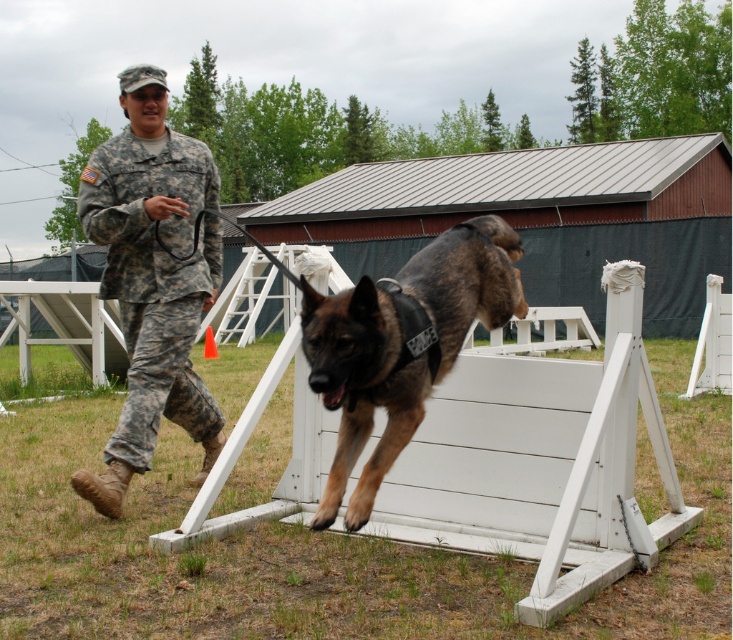
Can you confirm if camouflage uniform at left is positioned to the left of brindle fur dog at center?

Correct, you'll find camouflage uniform at left to the left of brindle fur dog at center.

Image resolution: width=733 pixels, height=640 pixels. What do you see at coordinates (152, 280) in the screenshot?
I see `camouflage uniform at left` at bounding box center [152, 280].

The width and height of the screenshot is (733, 640). Find the location of `camouflage uniform at left`. camouflage uniform at left is located at coordinates (152, 280).

Is white wood hurdle at center bigger than camouflage uniform at left?

Yes, white wood hurdle at center is bigger than camouflage uniform at left.

Which is in front, point (567, 604) or point (108, 448)?

Positioned in front is point (567, 604).

You are a GUI agent. You are given a task and a screenshot of the screen. Output one action in this format:
    pyautogui.click(x=<x>, y=<y>)
    Task: Click on the white wood hurdle at center
    
    Given the screenshot: What is the action you would take?
    pyautogui.click(x=541, y=464)

Is white wood hurdle at center thinner than brindle fur dog at center?

No.

Where is `white wood hurdle at center`? white wood hurdle at center is located at coordinates (541, 464).